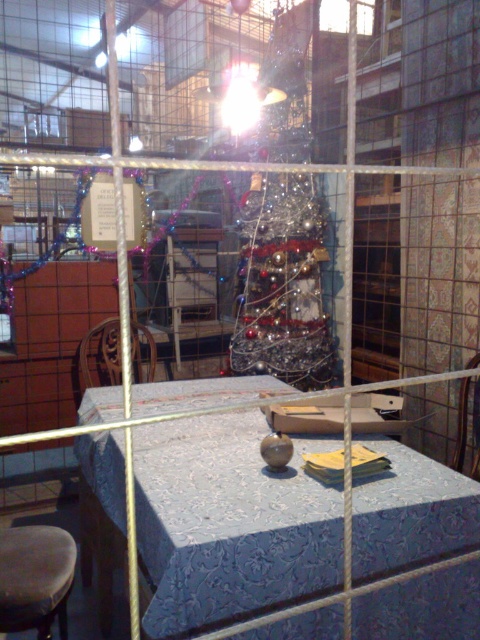
Looking at this image, you are a visitor in the museum and want to take a photo of the shiny metallic christmas tree at center without the brown leather stool at lower left appearing in the frame. Is the size of the tree sufficient to do so?

The shiny metallic christmas tree at center is larger in size than the brown leather stool at lower left, so it is possible to frame the photo to focus solely on the tree while excluding the stool.

You are standing in front of the museum exhibit and want to touch both the point at position (x=227, y=529) and the point at position (x=29, y=620). Which point will you reach first?

You will reach the point at position (x=227, y=529) first because it is closer to you than the point at position (x=29, y=620).